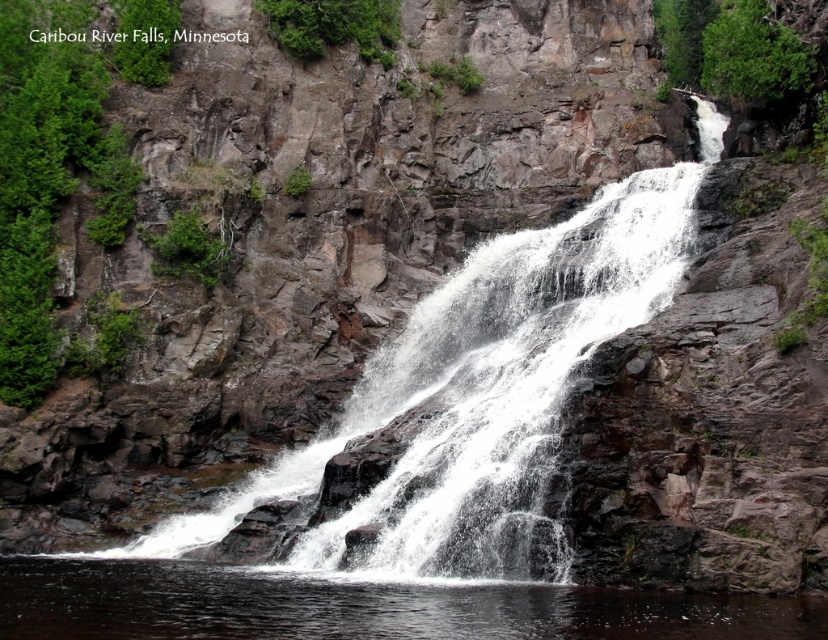
Based on the photo, you are a photographer planning to capture the Caribou River Falls. You notice the white frothy water at center and the clear water at center. Which of these two waters is higher in elevation?

The white frothy water at center is much taller as clear water at center, so the white frothy water at center has a higher elevation.

You are a photographer planning to capture the Caribou River Falls. You notice two distinct water areas in the scene. One is the white frothy water at center and the other is the clear water at center. Which of these two areas would you focus on to highlight the falls dynamic and powerful display?

The white frothy water at center is larger in size than the clear water at center, so focusing on the white frothy water at center would better highlight the falls dynamic and powerful display as it indicates force and movement.

You are standing at the edge of Caribou River Falls and see both the white frothy water at center and the clear water at center. Which body of water is closer to you?

The white frothy water at center is closer to you because it is positioned further to the viewer than the clear water at center.